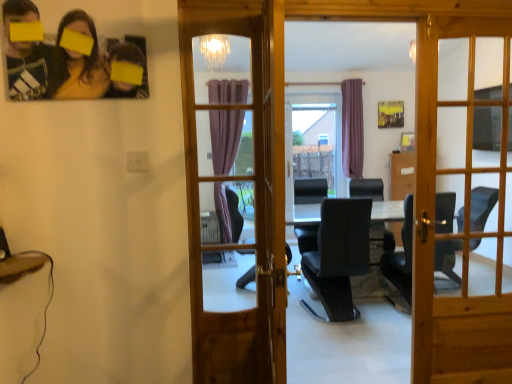
What do you see at coordinates (234, 188) in the screenshot? I see `wooden door at center, which ranks as the 2th door in right-to-left order` at bounding box center [234, 188].

The image size is (512, 384). I want to click on wooden door at center, the 1th door from the left, so click(234, 188).

This screenshot has height=384, width=512. Describe the element at coordinates (69, 59) in the screenshot. I see `matte black photo frame at upper left` at that location.

Identify the location of wooden door at center, the 1th door from the left. Image resolution: width=512 pixels, height=384 pixels. (234, 188).

In terms of width, does black leather chair at center look wider or thinner when compared to wooden door at center, the 1th door from the left?

In the image, black leather chair at center appears to be wider than wooden door at center, the 1th door from the left.

Is black leather chair at center positioned beyond the bounds of wooden door at center, the 1th door from the left?

Yes, black leather chair at center is not within wooden door at center, the 1th door from the left.

Between black leather chair at center and wooden door at center, which ranks as the 2th door in right-to-left order, which one has larger size?

black leather chair at center.

Image resolution: width=512 pixels, height=384 pixels. In order to click on chair to the right of wooden door at center, which ranks as the 2th door in right-to-left order in this screenshot , I will do [366, 188].

At what (x,y) coordinates should I click in order to perform the action: click on chair below the matte black photo frame at upper left (from the image's perspective). Please return your answer as a coordinate pair (x, y). Looking at the image, I should click on pos(366,188).

Which is less distant, (40, 31) or (393, 242)?

The point (40, 31) is closer to the camera.

Can black leather chair at center be found inside matte black photo frame at upper left?

Actually, black leather chair at center is outside matte black photo frame at upper left.

Is matte black photo frame at upper left thinner than black leather chair at center?

Correct, the width of matte black photo frame at upper left is less than that of black leather chair at center.

Considering the relative positions of matte black photo frame at upper left and wooden door at center, the 1th door from the left, in the image provided, is matte black photo frame at upper left in front of wooden door at center, the 1th door from the left,?

Yes.

From a real-world perspective, who is located higher, matte black photo frame at upper left or wooden door at center, which ranks as the 2th door in right-to-left order?

In real-world perspective, matte black photo frame at upper left is above.

Is matte black photo frame at upper left positioned with its back to wooden door at center, the 1th door from the left?

No, matte black photo frame at upper left is not facing the opposite direction of wooden door at center, the 1th door from the left.

Between wooden door at center, the 1th door from the left, and wooden door at center, marked as the 1th door in a right-to-left arrangement, which one is positioned in front?

wooden door at center, the 1th door from the left.

From a real-world perspective, between wooden door at center, the 1th door from the left, and wooden door at center, which ranks as the 2th door in left-to-right order, who is vertically higher?

From a 3D spatial view, wooden door at center, the 1th door from the left, is above.

Who is shorter, wooden door at center, the 1th door from the left, or wooden door at center, marked as the 1th door in a right-to-left arrangement?

With less height is wooden door at center, the 1th door from the left.

Is wooden door at center, which ranks as the 2th door in right-to-left order, inside the boundaries of wooden door at center, which ranks as the 2th door in left-to-right order, or outside?

wooden door at center, which ranks as the 2th door in right-to-left order, is outside wooden door at center, which ranks as the 2th door in left-to-right order.

How many degrees apart are the facing directions of matte black photo frame at upper left and wooden door at center, which ranks as the 2th door in left-to-right order?

The angular difference between matte black photo frame at upper left and wooden door at center, which ranks as the 2th door in left-to-right order, is 1.09 degrees.

In the scene shown: Is matte black photo frame at upper left not near wooden door at center, marked as the 1th door in a right-to-left arrangement?

That's right, there is a large distance between matte black photo frame at upper left and wooden door at center, marked as the 1th door in a right-to-left arrangement.

What are the coordinates of `the 2nd door below the matte black photo frame at upper left (from the image's perspective)` in the screenshot? It's located at (454, 236).

From the image's perspective, between matte black photo frame at upper left and wooden door at center, marked as the 1th door in a right-to-left arrangement, who is located below?

From the image's view, wooden door at center, marked as the 1th door in a right-to-left arrangement, is below.

At what (x,y) coordinates should I click in order to perform the action: click on chair below the wooden door at center, the 1th door from the left (from a real-world perspective). Please return your answer as a coordinate pair (x, y). This screenshot has height=384, width=512. Looking at the image, I should click on (366, 188).

Can you confirm if wooden door at center, the 1th door from the left, is thinner than black leather chair at center?

Yes.

Looking at the image, does wooden door at center, the 1th door from the left, seem bigger or smaller compared to black leather chair at center?

wooden door at center, the 1th door from the left, is smaller than black leather chair at center.

Is wooden door at center, which ranks as the 2th door in right-to-left order, completely or partially outside of black leather chair at center?

That's correct, wooden door at center, which ranks as the 2th door in right-to-left order, is outside of black leather chair at center.

Considering the positions of objects wooden door at center, which ranks as the 2th door in right-to-left order, and matte black photo frame at upper left in the image provided, who is more to the right, wooden door at center, which ranks as the 2th door in right-to-left order, or matte black photo frame at upper left?

From the viewer's perspective, wooden door at center, which ranks as the 2th door in right-to-left order, appears more on the right side.

Is wooden door at center, which ranks as the 2th door in right-to-left order, closer to the viewer compared to matte black photo frame at upper left?

No, the depth of wooden door at center, which ranks as the 2th door in right-to-left order, is greater than that of matte black photo frame at upper left.

Is wooden door at center, the 1th door from the left, thinner than matte black photo frame at upper left?

Incorrect, the width of wooden door at center, the 1th door from the left, is not less than that of matte black photo frame at upper left.

From a real-world perspective, who is located higher, wooden door at center, which ranks as the 2th door in right-to-left order, or matte black photo frame at upper left?

matte black photo frame at upper left, from a real-world perspective.

Identify the location of the 2nd door in front of the black leather chair at center, starting your count from the anchor. The height and width of the screenshot is (384, 512). (234, 188).

Locate an element on the screen. The width and height of the screenshot is (512, 384). chair behind the matte black photo frame at upper left is located at coordinates (366, 188).

Considering their positions, is black leather chair at center positioned closer to matte black photo frame at upper left than wooden door at center, which ranks as the 2th door in right-to-left order?

black leather chair at center lies closer to matte black photo frame at upper left than the other object.

Considering their positions, is matte black photo frame at upper left positioned closer to black leather chair at center than wooden door at center, which ranks as the 2th door in right-to-left order?

wooden door at center, which ranks as the 2th door in right-to-left order, lies closer to black leather chair at center than the other object.

Looking at the image, which one is located closer to matte black photo frame at upper left, wooden door at center, marked as the 1th door in a right-to-left arrangement, or black leather chair at center?

Among the two, wooden door at center, marked as the 1th door in a right-to-left arrangement, is located nearer to matte black photo frame at upper left.

Estimate the real-world distances between objects in this image. Which object is closer to black leather chair at center, wooden door at center, marked as the 1th door in a right-to-left arrangement, or wooden door at center, the 1th door from the left?

wooden door at center, marked as the 1th door in a right-to-left arrangement, lies closer to black leather chair at center than the other object.

Looking at the image, which one is located further to matte black photo frame at upper left, wooden door at center, the 1th door from the left, or black leather chair at center?

wooden door at center, the 1th door from the left, is positioned further to the anchor matte black photo frame at upper left.

Estimate the real-world distances between objects in this image. Which object is further from wooden door at center, which ranks as the 2th door in right-to-left order, black leather chair at center or matte black photo frame at upper left?

matte black photo frame at upper left.

From the image, which object appears to be farther from wooden door at center, which ranks as the 2th door in right-to-left order, matte black photo frame at upper left or black leather chair at center?

matte black photo frame at upper left lies further to wooden door at center, which ranks as the 2th door in right-to-left order, than the other object.

Estimate the real-world distances between objects in this image. Which object is further from wooden door at center, marked as the 1th door in a right-to-left arrangement, matte black photo frame at upper left or wooden door at center, which ranks as the 2th door in right-to-left order?

wooden door at center, which ranks as the 2th door in right-to-left order, is positioned further to the anchor wooden door at center, marked as the 1th door in a right-to-left arrangement.

You are a GUI agent. You are given a task and a screenshot of the screen. Output one action in this format:
    pyautogui.click(x=<x>, y=<y>)
    Task: Click on the door between matte black photo frame at upper left and wooden door at center, marked as the 1th door in a right-to-left arrangement, from left to right
    The width and height of the screenshot is (512, 384).
    Given the screenshot: What is the action you would take?
    pyautogui.click(x=234, y=188)

Find the location of a particular element. This screenshot has height=384, width=512. door between wooden door at center, which ranks as the 2th door in right-to-left order, and black leather chair at center from front to back is located at coordinates (454, 236).